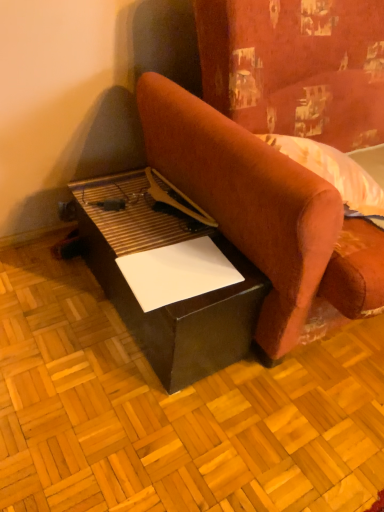
Image resolution: width=384 pixels, height=512 pixels. I want to click on black leather table at lower left, so click(173, 303).

Locate an element on the screen. This screenshot has height=512, width=384. white paper at lower center is located at coordinates (177, 272).

Find the location of a particular element. This screenshot has width=384, height=512. black leather table at lower left is located at coordinates (173, 303).

Can black leather table at lower left be found inside white paper at lower center?

No, black leather table at lower left is not surrounded by white paper at lower center.

Are white paper at lower center and black leather table at lower left far apart?

No, white paper at lower center is not far away from black leather table at lower left.

From the image's perspective, relative to black leather table at lower left, is white paper at lower center above or below?

white paper at lower center is situated lower than black leather table at lower left in the image.

From a real-world perspective, which is physically above, white paper at lower center or black leather table at lower left?

white paper at lower center, from a real-world perspective.

Looking at this image, considering the positions of objects black leather table at lower left and velvet-like red couch at center in the image provided, who is more to the left, black leather table at lower left or velvet-like red couch at center?

black leather table at lower left is more to the left.

Can velvet-like red couch at center be found inside black leather table at lower left?

No, black leather table at lower left does not contain velvet-like red couch at center.

Which is in front, point (95, 189) or point (277, 282)?

Positioned in front is point (277, 282).

From a real-world perspective, does velvet-like red couch at center sit lower than white paper at lower center?

Incorrect, from a real-world perspective, velvet-like red couch at center is higher than white paper at lower center.

Looking at this image, are velvet-like red couch at center and white paper at lower center located far from each other?

They are positioned close to each other.

From the image's perspective, is velvet-like red couch at center located beneath white paper at lower center?

Incorrect, from the image's perspective, velvet-like red couch at center is higher than white paper at lower center.

How distant is velvet-like red couch at center from black leather table at lower left?

velvet-like red couch at center is 8.02 inches from black leather table at lower left.

From their relative heights in the image, would you say velvet-like red couch at center is taller or shorter than black leather table at lower left?

Considering their sizes, velvet-like red couch at center has more height than black leather table at lower left.

Which object is wider, velvet-like red couch at center or black leather table at lower left?

velvet-like red couch at center is wider.

Which is more to the right, velvet-like red couch at center or black leather table at lower left?

Positioned to the right is velvet-like red couch at center.

Considering the sizes of black leather table at lower left and white paper at lower center in the image, is black leather table at lower left taller or shorter than white paper at lower center?

black leather table at lower left is taller than white paper at lower center.

From a real-world perspective, is black leather table at lower left physically above white paper at lower center?

Actually, black leather table at lower left is physically below white paper at lower center in the real world.

Does black leather table at lower left have a lesser width compared to white paper at lower center?

In fact, black leather table at lower left might be wider than white paper at lower center.

Is black leather table at lower left facing towards white paper at lower center?

No, black leather table at lower left does not turn towards white paper at lower center.

Does white paper at lower center appear on the left side of velvet-like red couch at center?

Yes.

How different are the orientations of white paper at lower center and velvet-like red couch at center in degrees?

The angle between the facing direction of white paper at lower center and the facing direction of velvet-like red couch at center is 4.36 degrees.

Is white paper at lower center aimed at velvet-like red couch at center?

No.

From the image's perspective, is white paper at lower center under velvet-like red couch at center?

Yes, from the image's perspective, white paper at lower center is beneath velvet-like red couch at center.

In the image, there is a white paper at lower center. Where is `table below it (from a real-world perspective)`? Image resolution: width=384 pixels, height=512 pixels. table below it (from a real-world perspective) is located at coordinates (173, 303).

The width and height of the screenshot is (384, 512). Find the location of `studio couch in front of the black leather table at lower left`. studio couch in front of the black leather table at lower left is located at coordinates (247, 200).

Considering their positions, is black leather table at lower left positioned further to white paper at lower center than velvet-like red couch at center?

velvet-like red couch at center.

Looking at this image, when comparing their distances from white paper at lower center, does velvet-like red couch at center or black leather table at lower left seem further?

velvet-like red couch at center lies further to white paper at lower center than the other object.

Looking at the image, which one is located further to velvet-like red couch at center, black leather table at lower left or white paper at lower center?

Among the two, white paper at lower center is located further to velvet-like red couch at center.

Based on their spatial positions, is white paper at lower center or velvet-like red couch at center further from black leather table at lower left?

The object further to black leather table at lower left is velvet-like red couch at center.

Which object lies further to the anchor point velvet-like red couch at center, white paper at lower center or black leather table at lower left?

white paper at lower center is positioned further to the anchor velvet-like red couch at center.

From the image, which object appears to be nearer to black leather table at lower left, velvet-like red couch at center or white paper at lower center?

white paper at lower center is closer to black leather table at lower left.

Identify the location of paper between black leather table at lower left and velvet-like red couch at center. The height and width of the screenshot is (512, 384). (177, 272).